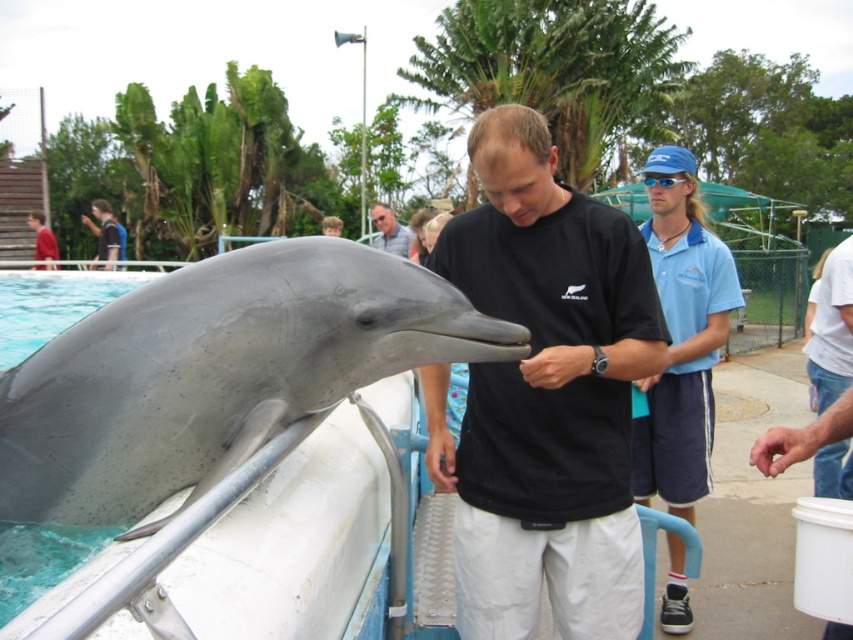
Is light brown hair at upper left thinner than gray matte dolphin at center?

Incorrect, light brown hair at upper left's width is not less than gray matte dolphin at center's.

Describe the element at coordinates (103, 234) in the screenshot. Image resolution: width=853 pixels, height=640 pixels. I see `light brown hair at upper left` at that location.

At what (x,y) coordinates should I click in order to perform the action: click on light brown hair at upper left. Please return your answer as a coordinate pair (x, y). The height and width of the screenshot is (640, 853). Looking at the image, I should click on (103, 234).

Does gray matte dolphin at left have a lesser height compared to gray matte dolphin at center?

Yes, gray matte dolphin at left is shorter than gray matte dolphin at center.

How distant is gray matte dolphin at left from gray matte dolphin at center?

gray matte dolphin at left is 8.49 feet away from gray matte dolphin at center.

Is point (428, 310) positioned before point (398, 244)?

Yes, it is.

The image size is (853, 640). I want to click on gray matte dolphin at left, so click(x=218, y=372).

Is black matte shirt at center below light brown hair at upper left?

Yes.

Who is positioned more to the right, black matte shirt at center or light brown hair at upper left?

black matte shirt at center

What do you see at coordinates (544, 396) in the screenshot? The image size is (853, 640). I see `black matte shirt at center` at bounding box center [544, 396].

Where is `black matte shirt at center`? black matte shirt at center is located at coordinates (544, 396).